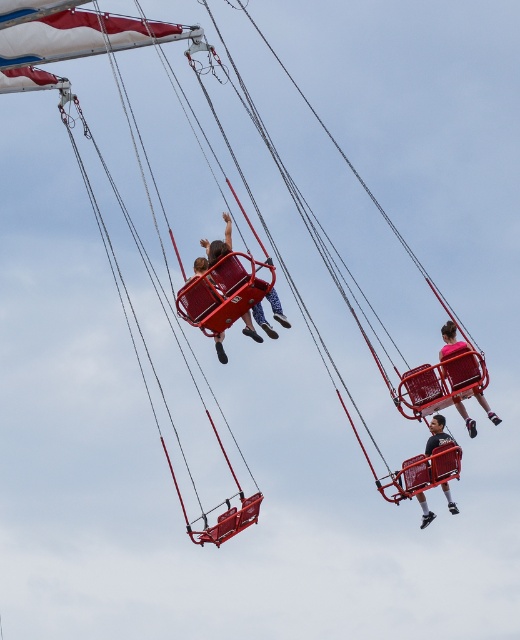
Question: Estimate the real-world distances between objects in this image. Which object is closer to the matte red swing at center?

Choices:
 (A) matte red swing at right
 (B) matte black helmet at center

Answer: (A)

Question: Which point is closer to the camera?

Choices:
 (A) (261, 314)
 (B) (449, 332)
 (C) (420, 502)

Answer: (A)

Question: Does matte red swing at center have a larger size compared to matte black helmet at center?

Choices:
 (A) yes
 (B) no

Answer: (A)

Question: Which object is closer to the camera taking this photo?

Choices:
 (A) matte red swing at center
 (B) matte black helmet at center

Answer: (A)

Question: In this image, where is matte red swing at center located relative to matte black helmet at center?

Choices:
 (A) below
 (B) above

Answer: (B)

Question: Does matte red swing at center appear on the right side of matte black helmet at center?

Choices:
 (A) yes
 (B) no

Answer: (B)